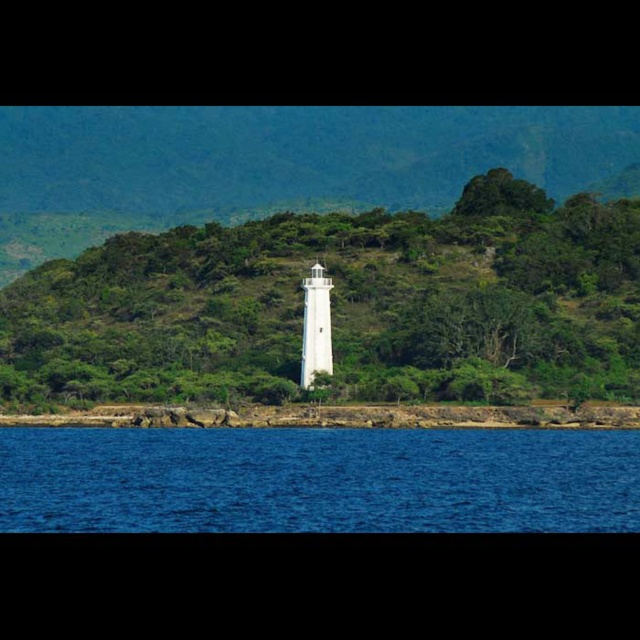
Question: Which object is positioned closest to the white matte/light tower at center?

Choices:
 (A) white smooth lighthouse at center
 (B) blue liquid water at lower center

Answer: (A)

Question: Which object is positioned closest to the white smooth lighthouse at center?

Choices:
 (A) white matte/light tower at center
 (B) blue liquid water at lower center

Answer: (A)

Question: Does white smooth lighthouse at center have a greater width compared to white matte/light tower at center?

Choices:
 (A) yes
 (B) no

Answer: (A)

Question: Can you confirm if blue liquid water at lower center is positioned to the right of white matte/light tower at center?

Choices:
 (A) yes
 (B) no

Answer: (B)

Question: Which point is farther to the camera?

Choices:
 (A) (312, 337)
 (B) (560, 260)
 (C) (508, 508)

Answer: (B)

Question: Does white smooth lighthouse at center have a smaller size compared to white matte/light tower at center?

Choices:
 (A) no
 (B) yes

Answer: (A)